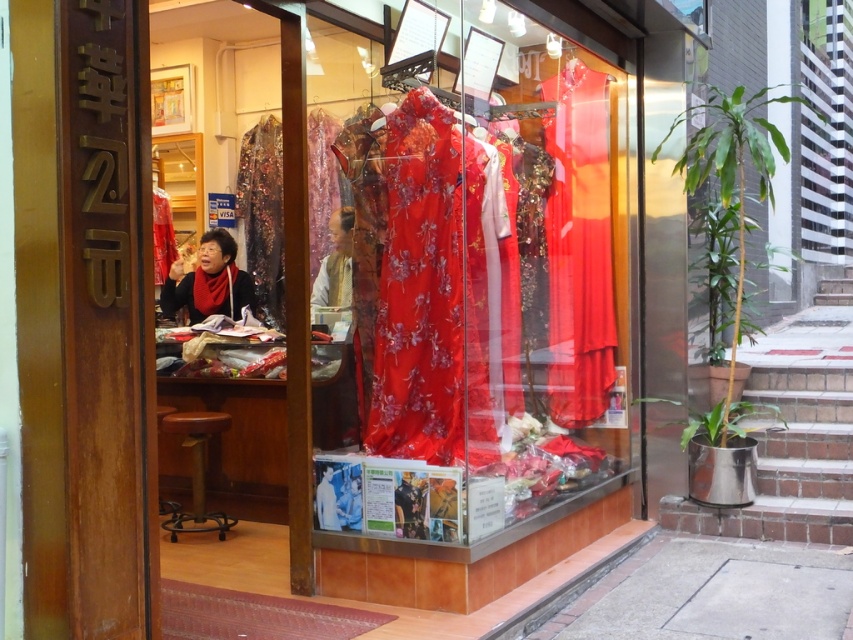
You are a customer in the shop and want to pick up the black satin blouse at center. Which direction should you look first to find it relative to the silky red dress at center?

The black satin blouse at center is below the silky red dress at center, so you should look downward from the silky red dress at center to find it.

You are a customer in the store and want to find the silky red dress at center. The shop assistant tells you that the dress is located at point (x=578, y=246). Where should you look to find it?

The silky red dress at center is represented by point (x=578, y=246), so you should look at the center of the display window where the coordinates are located.

Based on the photo, you are a customer in the store and want to buy both the silky red dress at center and the black satin blouse at center. The store has a discount for customers who buy items of different sizes. Can you get the discount?

Yes, the silky red dress at center is larger in size than the black satin blouse at center, so buying both qualifies for the discount as they are different sizes.